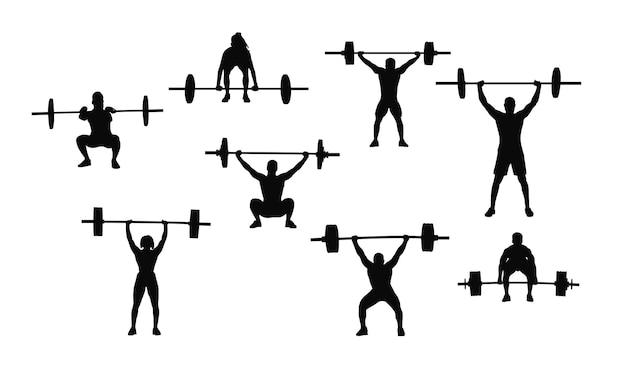
In order to click on bar in this screenshot , I will do `click(203, 87)`, `click(258, 151)`, `click(173, 222)`, `click(125, 107)`, `click(387, 50)`, `click(488, 81)`, `click(391, 235)`, `click(520, 281)`.